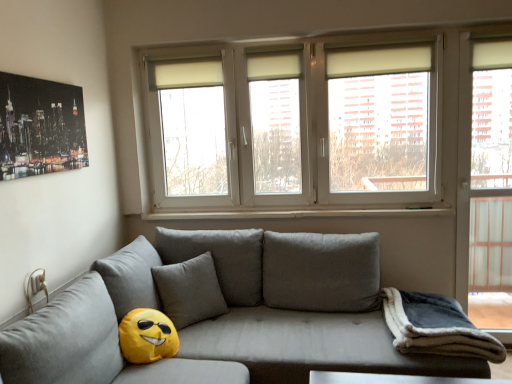
Question: Can you confirm if matte gray couch at center is taller than dark gray fleece blanket at lower right?

Choices:
 (A) yes
 (B) no

Answer: (A)

Question: Is matte gray couch at center facing away from dark gray fleece blanket at lower right?

Choices:
 (A) no
 (B) yes

Answer: (A)

Question: Does matte gray couch at center touch dark gray fleece blanket at lower right?

Choices:
 (A) yes
 (B) no

Answer: (B)

Question: Is matte gray couch at center positioned far away from dark gray fleece blanket at lower right?

Choices:
 (A) no
 (B) yes

Answer: (A)

Question: Is matte gray couch at center thinner than dark gray fleece blanket at lower right?

Choices:
 (A) yes
 (B) no

Answer: (B)

Question: Can you confirm if matte gray couch at center is smaller than dark gray fleece blanket at lower right?

Choices:
 (A) no
 (B) yes

Answer: (A)

Question: Does yellow fabric emoji at lower left appear on the left side of dark gray fleece blanket at lower right?

Choices:
 (A) yes
 (B) no

Answer: (A)

Question: Is yellow fabric emoji at lower left oriented towards dark gray fleece blanket at lower right?

Choices:
 (A) yes
 (B) no

Answer: (B)

Question: Is the surface of yellow fabric emoji at lower left in direct contact with dark gray fleece blanket at lower right?

Choices:
 (A) no
 (B) yes

Answer: (A)

Question: Would you say yellow fabric emoji at lower left is a long distance from dark gray fleece blanket at lower right?

Choices:
 (A) no
 (B) yes

Answer: (B)

Question: From a real-world perspective, is yellow fabric emoji at lower left over dark gray fleece blanket at lower right?

Choices:
 (A) no
 (B) yes

Answer: (B)

Question: Does yellow fabric emoji at lower left have a lesser width compared to dark gray fleece blanket at lower right?

Choices:
 (A) yes
 (B) no

Answer: (A)

Question: Is white plastic window sill at center smaller than white plastic window at upper center?

Choices:
 (A) yes
 (B) no

Answer: (A)